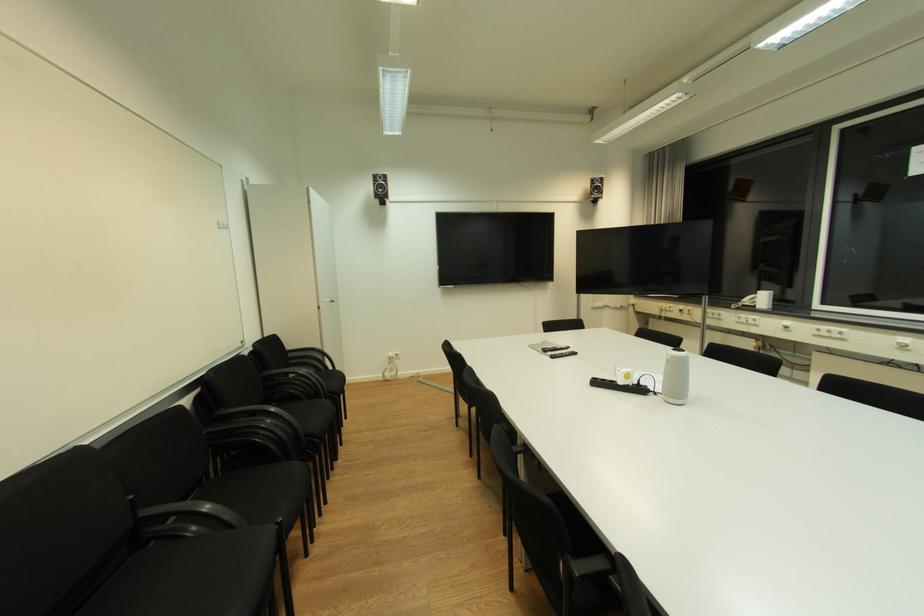
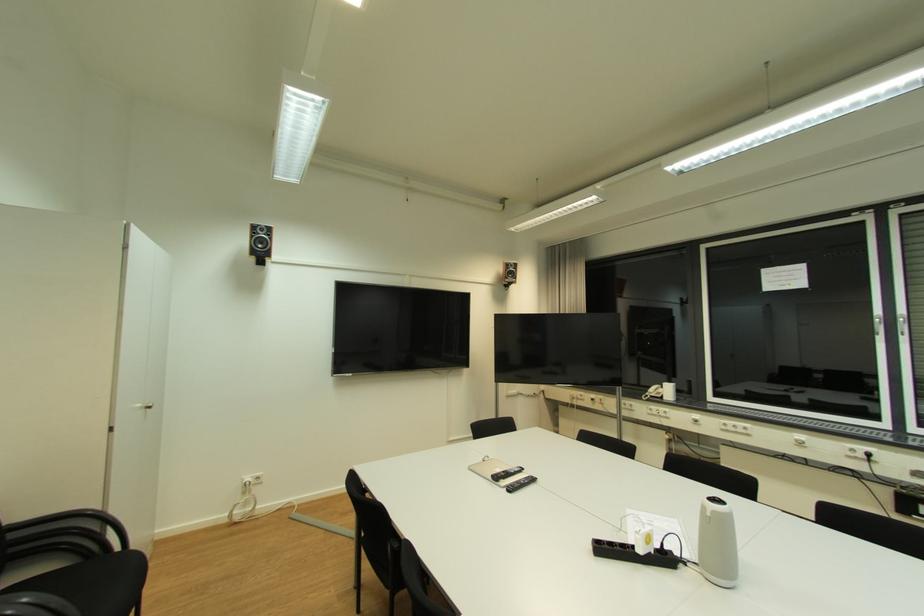
Where in the second image is the point corresponding to point 396,355 from the first image?

(253, 480)